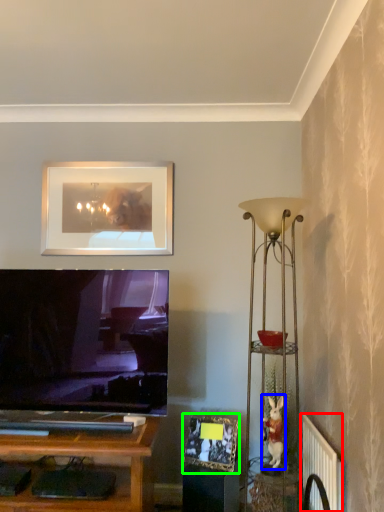
Question: Which is farther away from radiator (highlighted by a red box)? toy (highlighted by a blue box) or picture frame (highlighted by a green box)?

Choices:
 (A) toy
 (B) picture frame

Answer: (B)